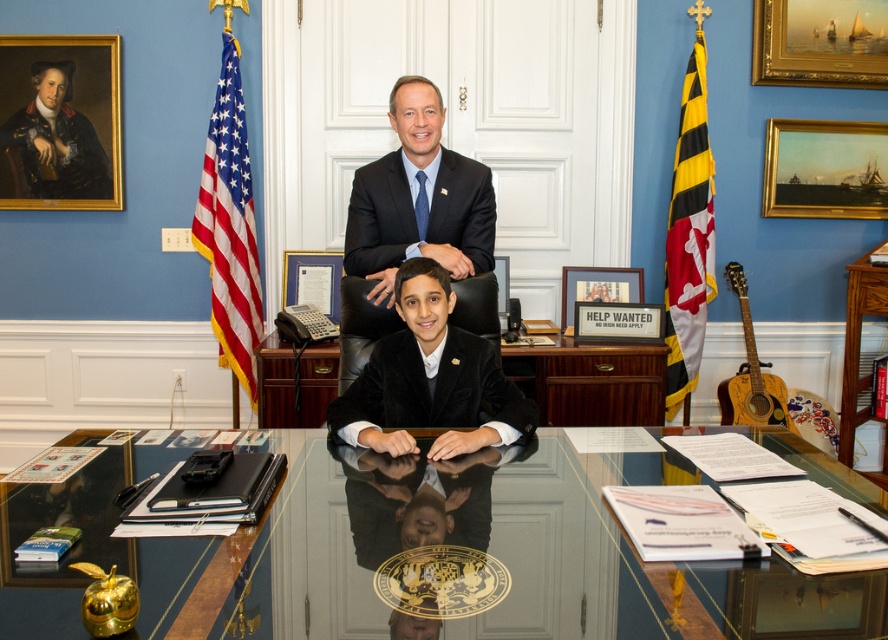
Question: Is black velvet suit at center positioned at the back of polyester american flag at left?

Choices:
 (A) yes
 (B) no

Answer: (B)

Question: Which of these objects is positioned closest to the matte black suit at upper center?

Choices:
 (A) polyester american flag at left
 (B) yellow and black striped fabric at right
 (C) black velvet suit at center
 (D) glossy glass table at center

Answer: (C)

Question: Which object is the closest to the oil painting ship at upper right?

Choices:
 (A) polyester american flag at left
 (B) black velvet suit at center
 (C) matte black suit at upper center

Answer: (C)

Question: Which of the following is the closest to the observer?

Choices:
 (A) (37, 138)
 (B) (458, 232)

Answer: (B)

Question: Is polyester american flag at left bigger than oil painting ship at upper right?

Choices:
 (A) yes
 (B) no

Answer: (A)

Question: Can you confirm if matte black suit at upper center is positioned below black velvet suit at center?

Choices:
 (A) yes
 (B) no

Answer: (B)